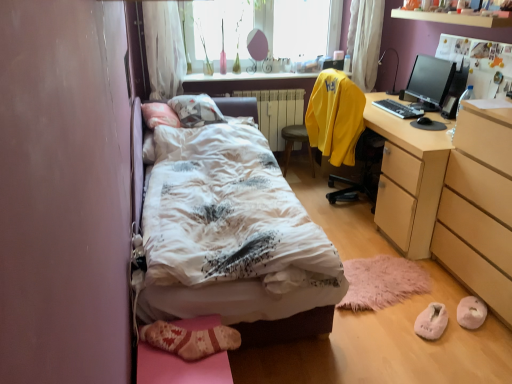
This screenshot has width=512, height=384. What are the coordinates of `free space above white fluffy slippers at lower right, acting as the first shoe starting from the right (from a real-world perspective)` in the screenshot? It's located at (475, 301).